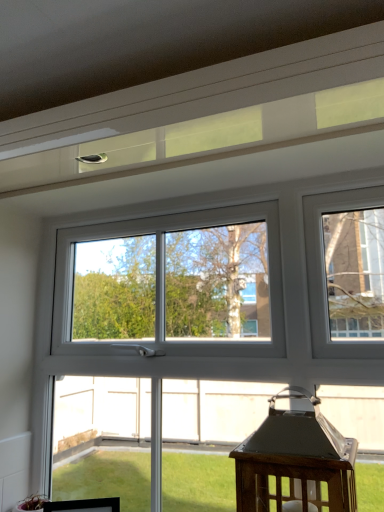
What do you see at coordinates (295, 480) in the screenshot? I see `wooden lantern at lower right` at bounding box center [295, 480].

Where is `wooden lantern at lower right`? This screenshot has height=512, width=384. wooden lantern at lower right is located at coordinates [x=295, y=480].

Where is `wooden lantern at lower right`? wooden lantern at lower right is located at coordinates (295, 480).